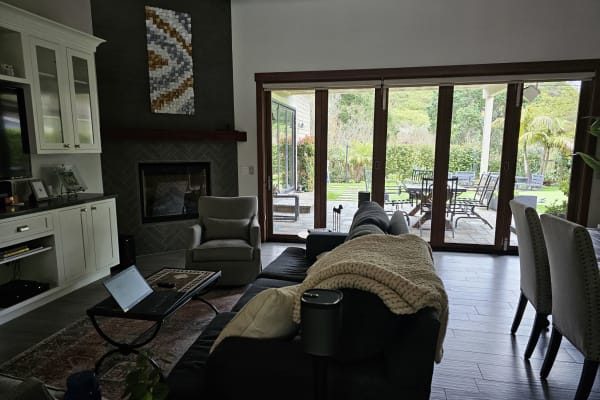
Find the location of `dining room chairs`. dining room chairs is located at coordinates (571, 288), (518, 258).